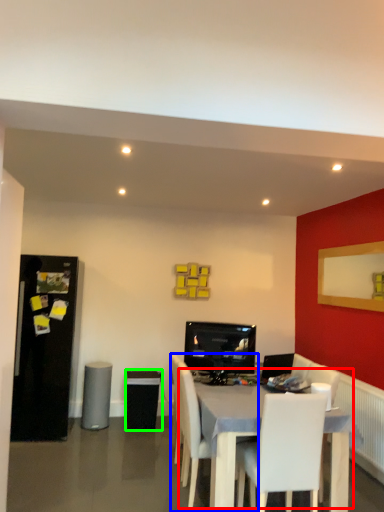
Question: Estimate the real-world distances between objects in this image. Which object is closer to table (highlighted by a red box), chair (highlighted by a blue box) or speaker (highlighted by a green box)?

Choices:
 (A) chair
 (B) speaker

Answer: (A)